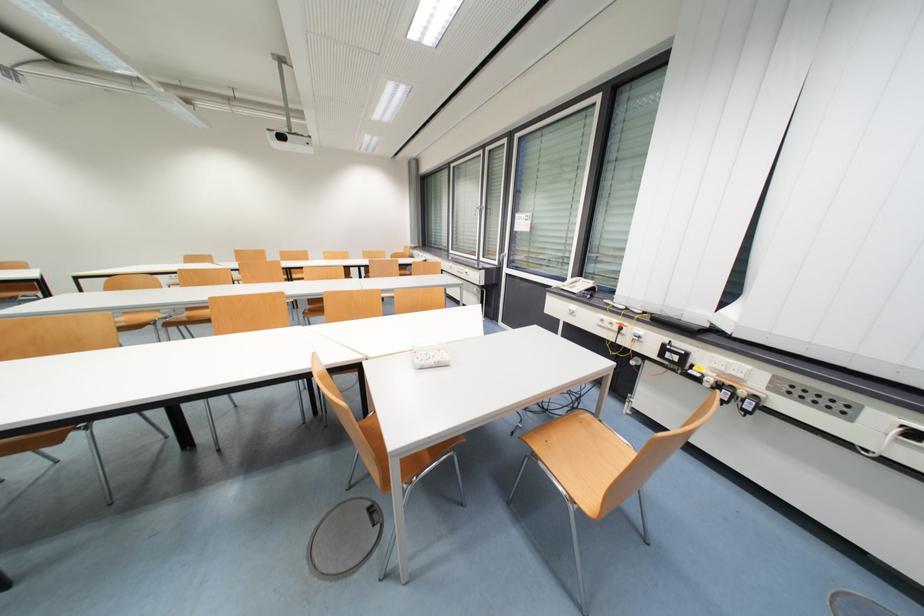
Find the location of a particular element. This screenshot has width=924, height=616. silver window handle is located at coordinates (477, 209).